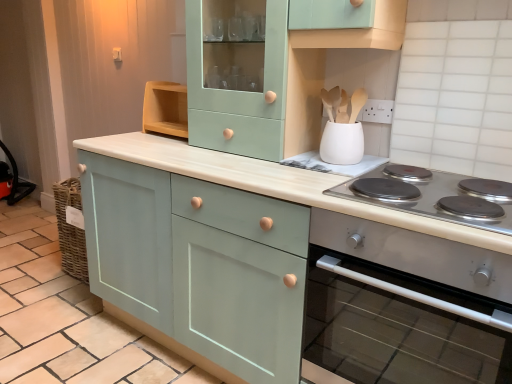
I want to click on free space on the front side of white matte utensil holder at upper center, so click(349, 178).